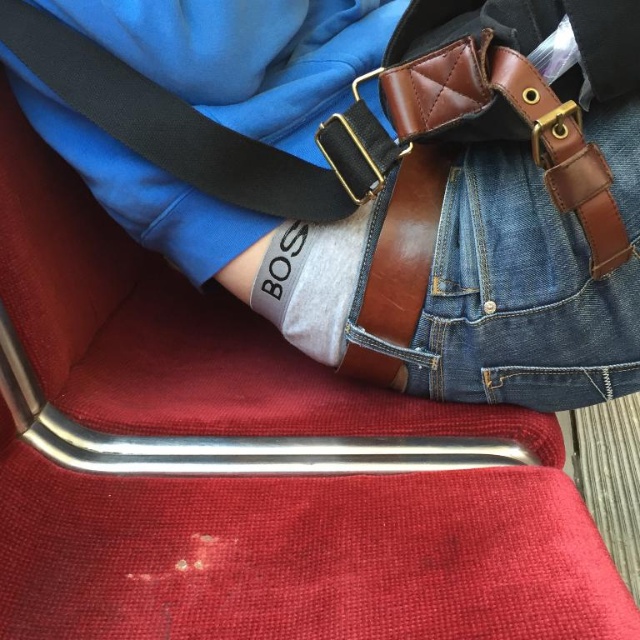
Question: Does brown leather bag at center appear over denim at center?

Choices:
 (A) yes
 (B) no

Answer: (A)

Question: Is brown leather bag at center below denim at center?

Choices:
 (A) yes
 (B) no

Answer: (B)

Question: Which point is closer to the camera?

Choices:
 (A) denim at center
 (B) brown leather bag at center

Answer: (B)

Question: Is brown leather bag at center bigger than denim at center?

Choices:
 (A) yes
 (B) no

Answer: (A)

Question: Which of the following is the closest to the observer?

Choices:
 (A) (513, 321)
 (B) (323, 269)

Answer: (A)